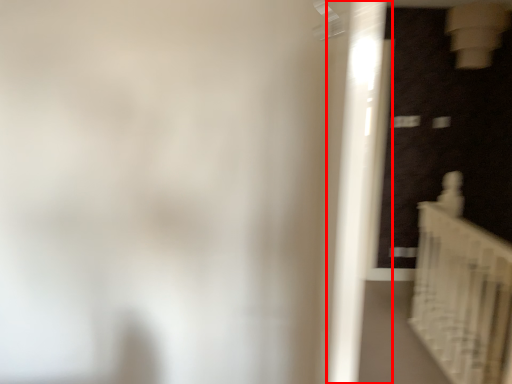
Question: From the image's perspective, where is door (annotated by the red box) located relative to stairs?

Choices:
 (A) below
 (B) above

Answer: (B)